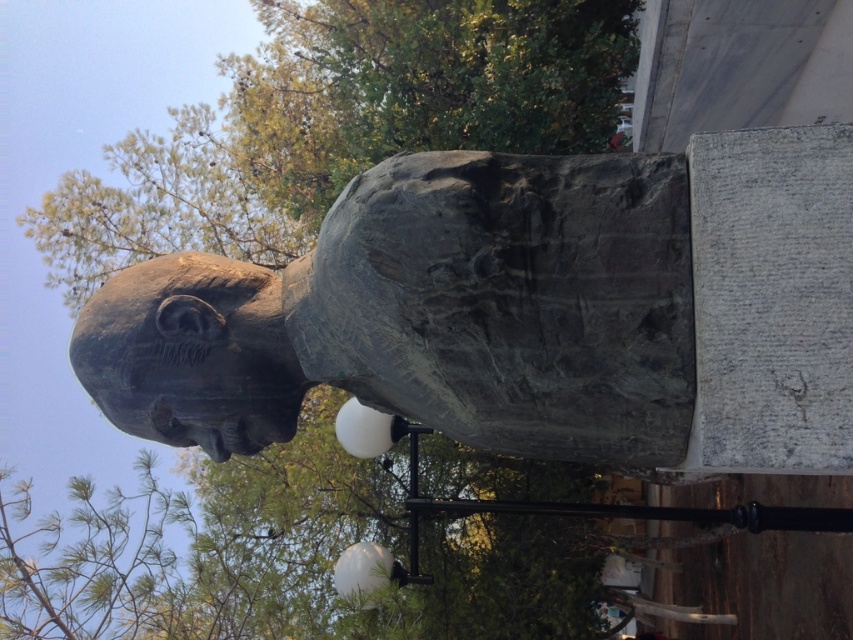
Question: Does bronze statue at center appear on the left side of bronze sculpture at center?

Choices:
 (A) no
 (B) yes

Answer: (A)

Question: Can you confirm if bronze statue at center is positioned above bronze sculpture at center?

Choices:
 (A) yes
 (B) no

Answer: (A)

Question: Is bronze statue at center to the left of bronze sculpture at center from the viewer's perspective?

Choices:
 (A) no
 (B) yes

Answer: (A)

Question: Which point is closer to the camera?

Choices:
 (A) bronze sculpture at center
 (B) bronze statue at center

Answer: (B)